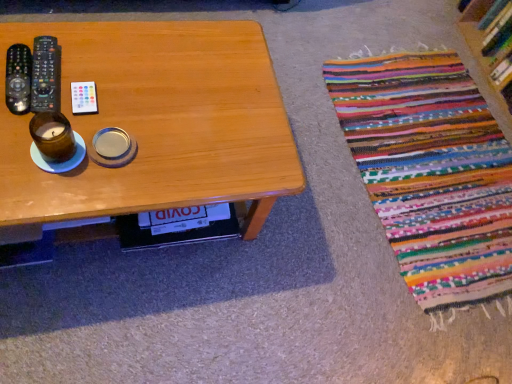
Locate an element on the screen. free space between wooden table at center and multicolored woven rug at lower right is located at coordinates (296, 228).